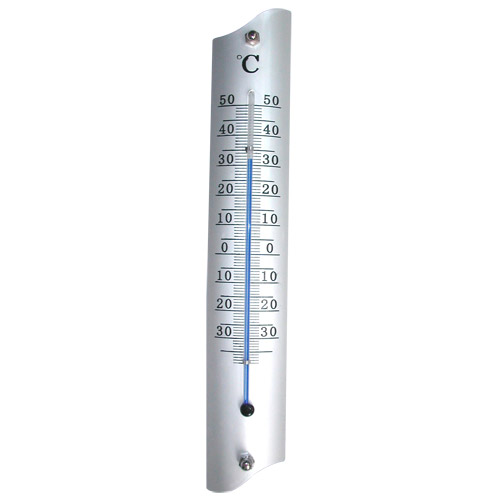
Identify the location of thermometer. The width and height of the screenshot is (500, 500). (269, 66).